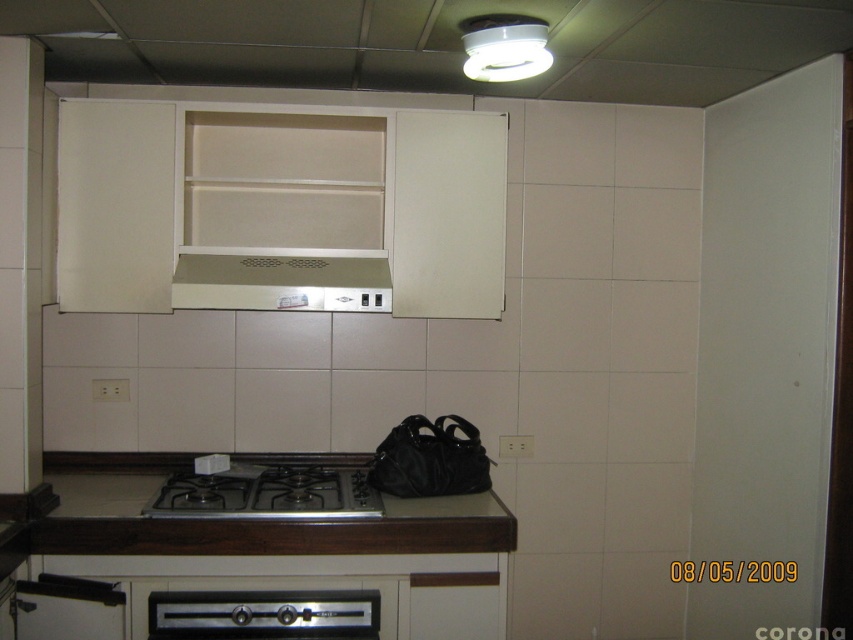
The image size is (853, 640). Identify the location of satin beige exhaust hood at center. (281, 282).

Does point (370, 269) lie in front of point (244, 589)?

No, it is not.

Where is `satin beige exhaust hood at center`? This screenshot has height=640, width=853. satin beige exhaust hood at center is located at coordinates (281, 282).

Can you confirm if brown wood counter top at center is bigger than black matte gas stove at center?

Yes, brown wood counter top at center is bigger than black matte gas stove at center.

The width and height of the screenshot is (853, 640). What do you see at coordinates (242, 518) in the screenshot? I see `brown wood counter top at center` at bounding box center [242, 518].

The height and width of the screenshot is (640, 853). I want to click on brown wood counter top at center, so click(242, 518).

Who is taller, brown wood counter top at center or satin beige exhaust hood at center?

brown wood counter top at center

Who is lower down, brown wood counter top at center or satin beige exhaust hood at center?

Positioned lower is brown wood counter top at center.

Which is behind, point (102, 496) or point (374, 308)?

The point (102, 496) is more distant.

Locate an element on the screen. Image resolution: width=853 pixels, height=640 pixels. brown wood counter top at center is located at coordinates (242, 518).